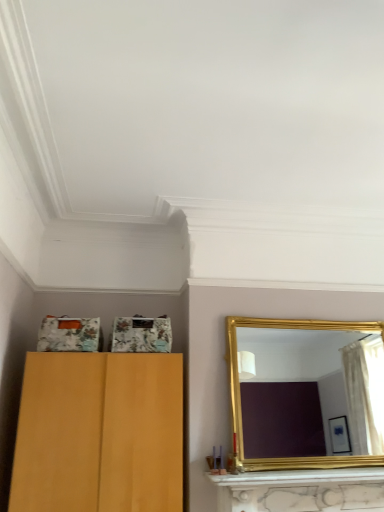
Question: Does gold-framed mirror at right lie in front of gold metallic mantle at lower center?

Choices:
 (A) no
 (B) yes

Answer: (A)

Question: From the image's perspective, would you say gold-framed mirror at right is positioned over gold metallic mantle at lower center?

Choices:
 (A) yes
 (B) no

Answer: (A)

Question: Is gold-framed mirror at right positioned far away from gold metallic mantle at lower center?

Choices:
 (A) no
 (B) yes

Answer: (B)

Question: Is gold-framed mirror at right looking in the opposite direction of gold metallic mantle at lower center?

Choices:
 (A) yes
 (B) no

Answer: (B)

Question: From the image's perspective, is gold-framed mirror at right under gold metallic mantle at lower center?

Choices:
 (A) yes
 (B) no

Answer: (B)

Question: Is gold-framed mirror at right at the right side of gold metallic mantle at lower center?

Choices:
 (A) no
 (B) yes

Answer: (B)

Question: From the image's perspective, is gold metallic mantle at lower center located beneath gold-framed mirror at right?

Choices:
 (A) no
 (B) yes

Answer: (B)

Question: From a real-world perspective, is gold metallic mantle at lower center on top of gold-framed mirror at right?

Choices:
 (A) no
 (B) yes

Answer: (A)

Question: Does gold metallic mantle at lower center have a lesser height compared to gold-framed mirror at right?

Choices:
 (A) yes
 (B) no

Answer: (A)

Question: Would you say gold metallic mantle at lower center is a long distance from gold-framed mirror at right?

Choices:
 (A) yes
 (B) no

Answer: (A)

Question: Considering the relative sizes of gold metallic mantle at lower center and gold-framed mirror at right in the image provided, is gold metallic mantle at lower center wider than gold-framed mirror at right?

Choices:
 (A) no
 (B) yes

Answer: (B)

Question: From a real-world perspective, is gold metallic mantle at lower center below gold-framed mirror at right?

Choices:
 (A) no
 (B) yes

Answer: (B)

Question: Looking at their shapes, would you say gold metallic mantle at lower center is wider or thinner than gold-framed mirror at right?

Choices:
 (A) wide
 (B) thin

Answer: (A)